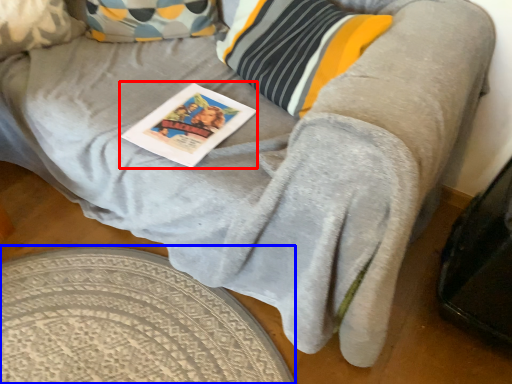
Question: Which of the following is the farthest to the observer, magazine (highlighted by a red box) or round table (highlighted by a blue box)?

Choices:
 (A) magazine
 (B) round table

Answer: (A)